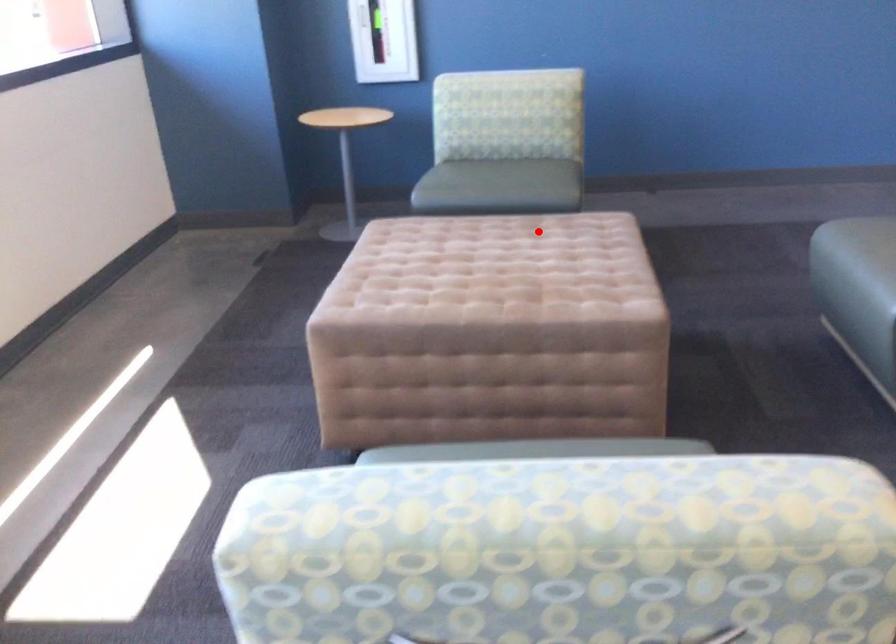
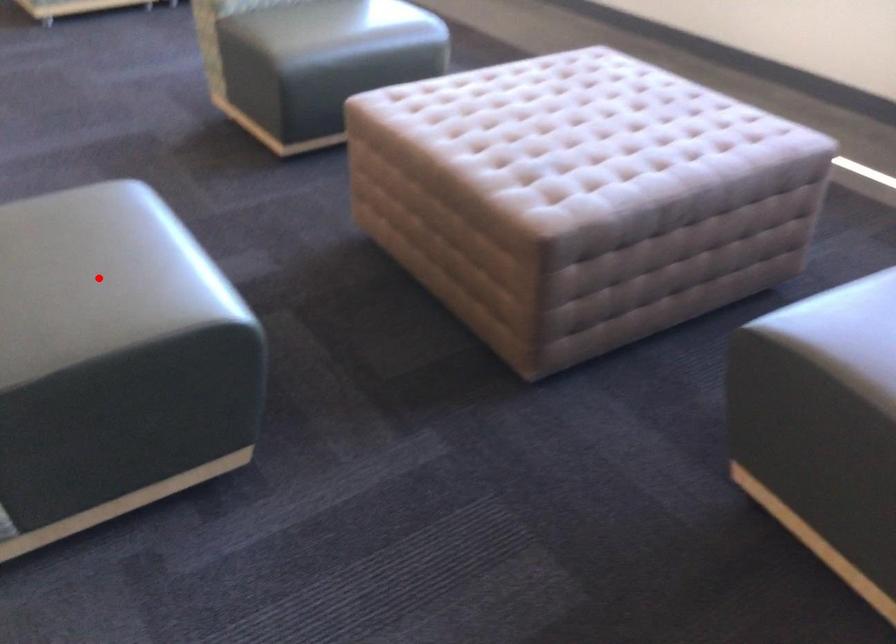
I am providing you with two images of the same scene from different viewpoints. A red point is marked on the first image and another point is marked on the second image. Do the highlighted points in image1 and image2 indicate the same real-world spot?

No